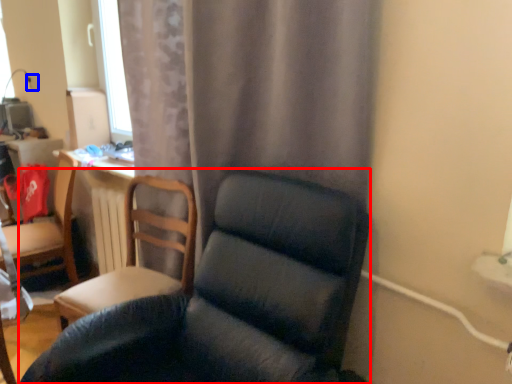
Question: Which object is further to the camera taking this photo, chair (highlighted by a red box) or electric outlet (highlighted by a blue box)?

Choices:
 (A) chair
 (B) electric outlet

Answer: (B)